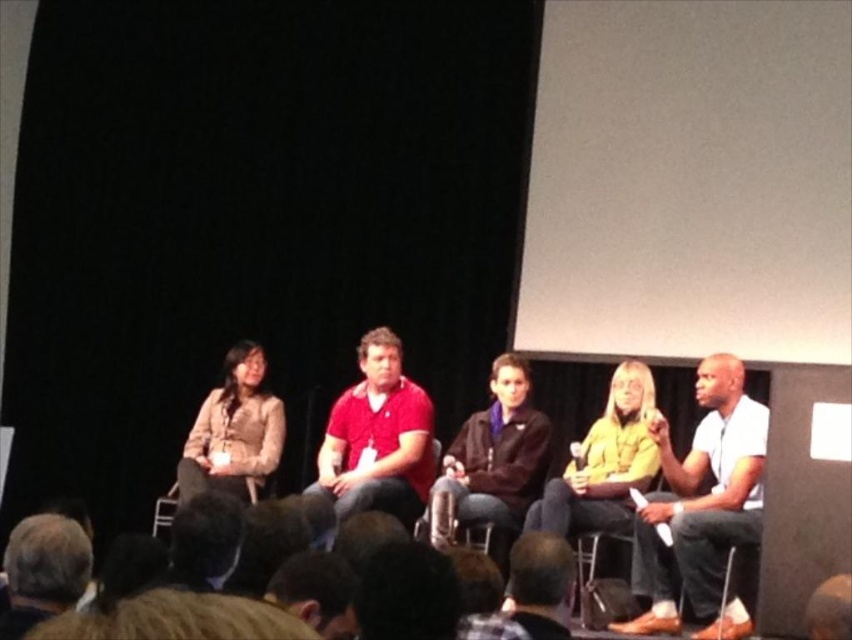
Question: Which point is closer to the camera?

Choices:
 (A) (643, 586)
 (B) (10, 620)
 (C) (337, 410)
 (D) (522, 396)

Answer: (B)

Question: Which object is the farthest from the matte red shirt at center?

Choices:
 (A) yellow matte jacket at center
 (B) white matte shirt at right
 (C) dark blue jacket at center
 (D) brown hair at lower left

Answer: (D)

Question: Can you confirm if white matte shirt at right is positioned above yellow matte jacket at center?

Choices:
 (A) no
 (B) yes

Answer: (A)

Question: Considering the relative positions of matte red shirt at center and brown hair at lower left in the image provided, where is matte red shirt at center located with respect to brown hair at lower left?

Choices:
 (A) left
 (B) right

Answer: (B)

Question: Among these objects, which one is nearest to the camera?

Choices:
 (A) matte beige jacket at left
 (B) yellow matte jacket at center
 (C) matte red shirt at center

Answer: (C)

Question: From the image, what is the correct spatial relationship of matte red shirt at center in relation to yellow matte jacket at center?

Choices:
 (A) left
 (B) right

Answer: (A)